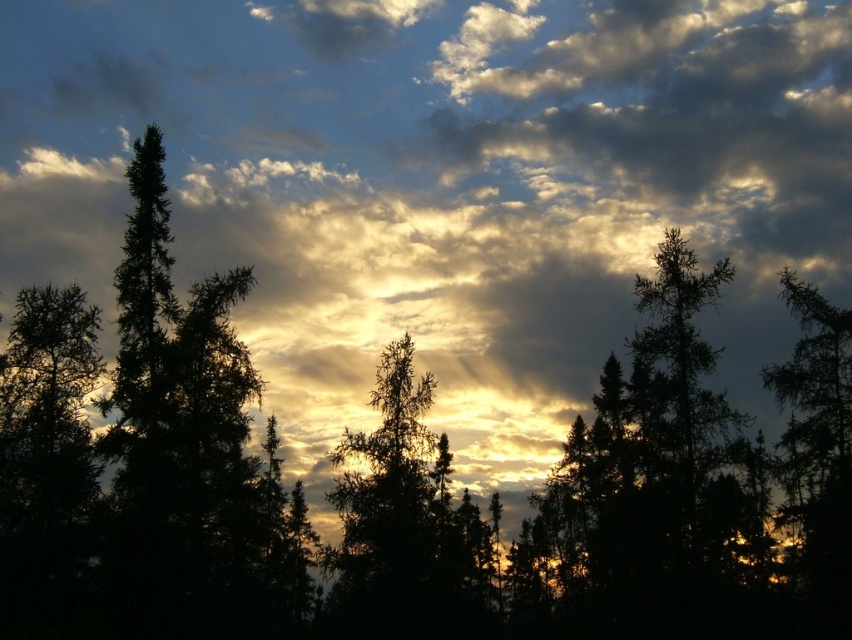
Question: Does silhouette pine at center appear on the right side of dark green textured tree at right?

Choices:
 (A) no
 (B) yes

Answer: (A)

Question: Among these points, which one is farthest from the camera?

Choices:
 (A) (799, 429)
 (B) (475, 541)

Answer: (B)

Question: Can you confirm if silhouette pine at center is positioned to the left of dark green textured tree at right?

Choices:
 (A) no
 (B) yes

Answer: (B)

Question: Which of the following is the closest to the observer?

Choices:
 (A) silhouette pine at center
 (B) dark green textured tree at right

Answer: (B)

Question: Which object is closer to the camera taking this photo?

Choices:
 (A) dark green textured tree at right
 (B) silhouette pine at center

Answer: (A)

Question: Considering the relative positions of silhouette pine at center and dark green textured tree at right in the image provided, where is silhouette pine at center located with respect to dark green textured tree at right?

Choices:
 (A) above
 (B) below

Answer: (B)